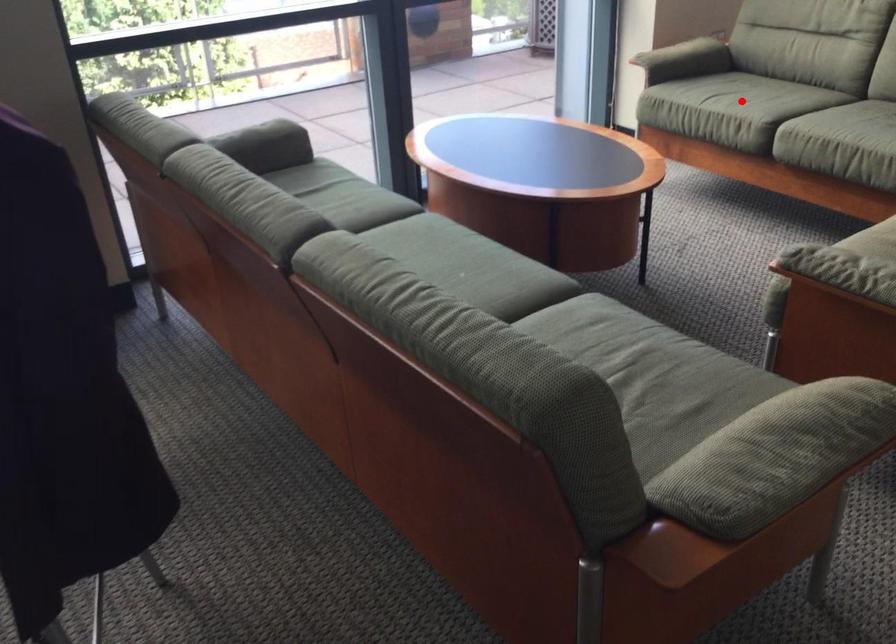
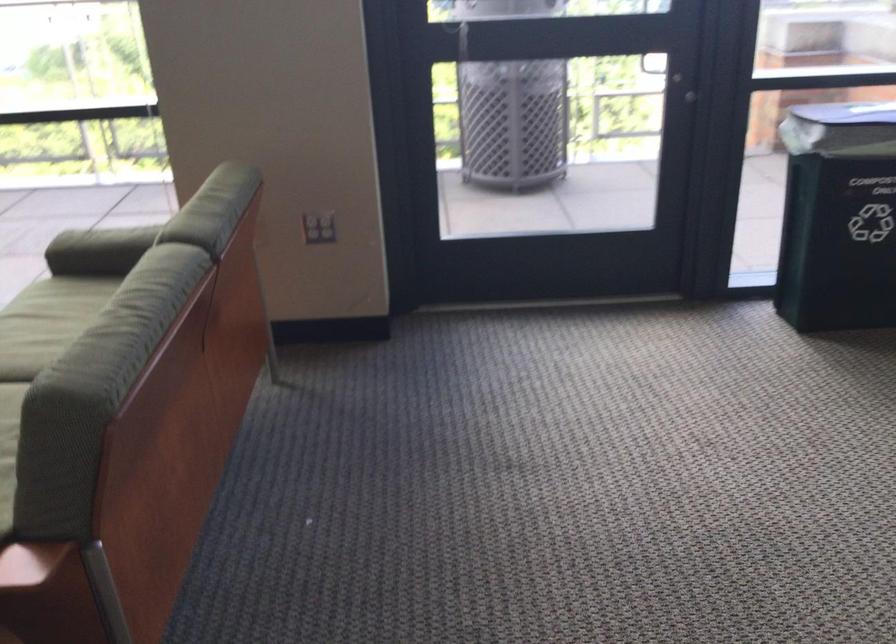
Question: I am providing you with two images of the same scene from different viewpoints. Given a red point in image1, look at the same physical point in image2. Is it:

Choices:
 (A) Closer to the viewpoint
 (B) Farther from the viewpoint

Answer: (A)